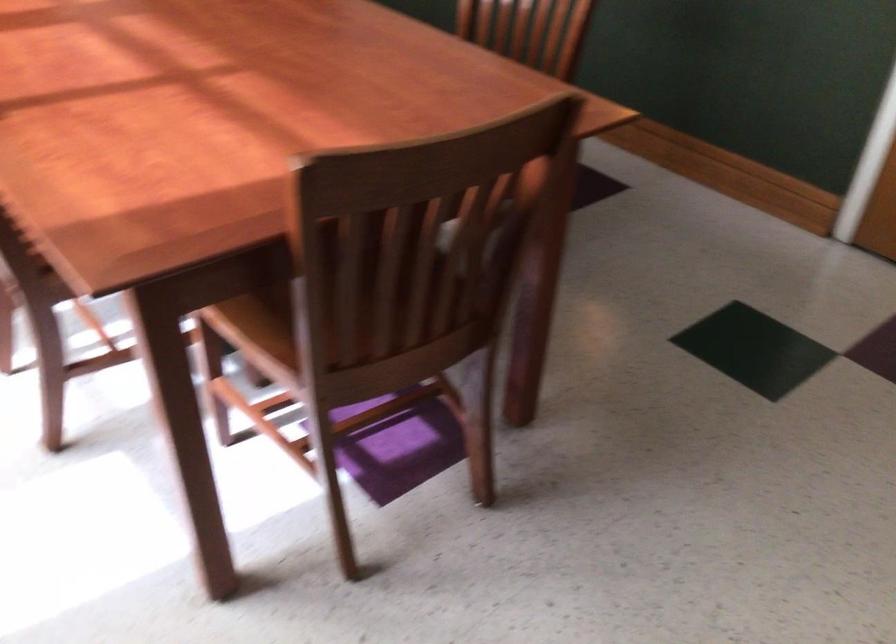
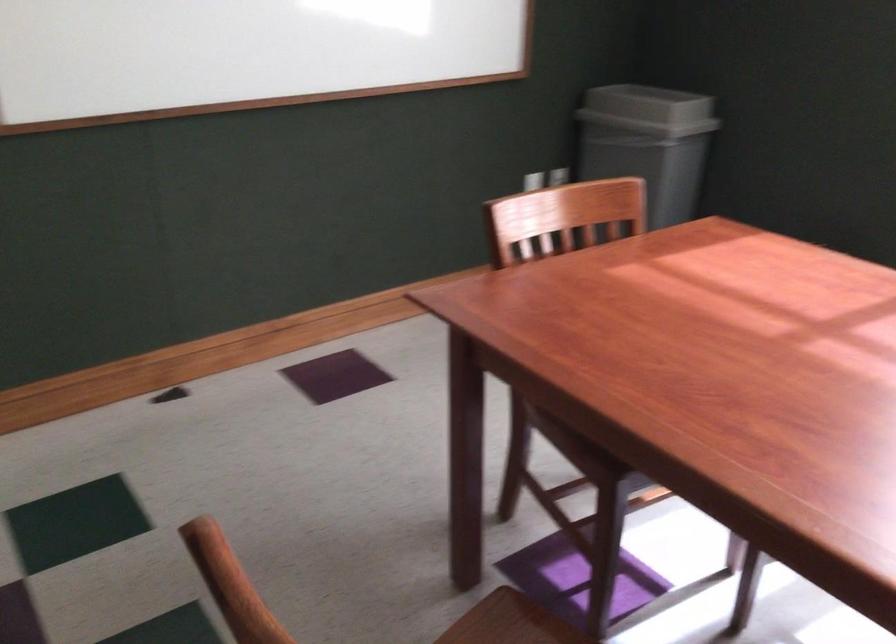
Question: I am providing you with two images of the same scene from different viewpoints. Please identify which objects are invisible in image2.

Choices:
 (A) wooden chair sitting surface
 (B) gray trash can lid
 (C) chair sitting surface
 (D) clear tape roll

Answer: (A)